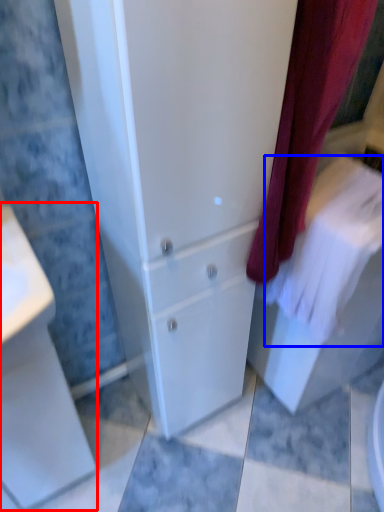
Question: Among these objects, which one is nearest to the camera, porcelain (highlighted by a red box) or bath towel (highlighted by a blue box)?

Choices:
 (A) porcelain
 (B) bath towel

Answer: (A)